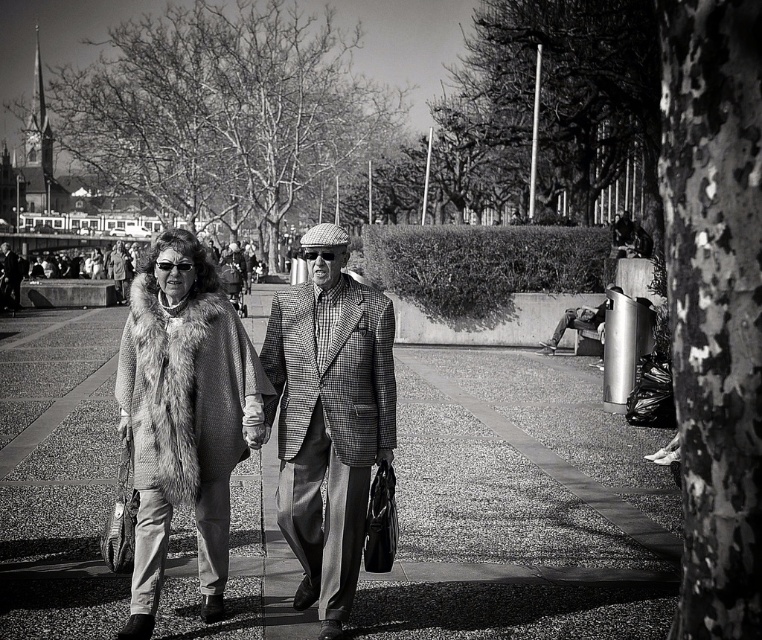
Is smooth concrete pavement at center to the left of fuzzy fur coat at center from the viewer's perspective?

In fact, smooth concrete pavement at center is to the right of fuzzy fur coat at center.

From the picture: Between smooth concrete pavement at center and fuzzy fur coat at center, which one has less height?

smooth concrete pavement at center

The height and width of the screenshot is (640, 762). Find the location of `smooth concrete pavement at center`. smooth concrete pavement at center is located at coordinates (520, 506).

Locate an element on the screen. The width and height of the screenshot is (762, 640). smooth concrete pavement at center is located at coordinates (520, 506).

Can you confirm if fuzzy fur coat at center is positioned to the left of houndstooth fabric jacket at center?

Indeed, fuzzy fur coat at center is positioned on the left side of houndstooth fabric jacket at center.

Who is more forward, (255,385) or (309,321)?

Point (255,385)

Does point (133, 477) lie in front of point (296, 358)?

Yes, it is in front of point (296, 358).

Locate an element on the screen. The height and width of the screenshot is (640, 762). fuzzy fur coat at center is located at coordinates (184, 417).

Is smooth concrete pavement at center wider than houndstooth fabric jacket at center?

Yes.

Is smooth concrete pavement at center shorter than houndstooth fabric jacket at center?

Indeed, smooth concrete pavement at center has a lesser height compared to houndstooth fabric jacket at center.

Does point (274, 561) come farther from viewer compared to point (365, 371)?

That is True.

The image size is (762, 640). In order to click on smooth concrete pavement at center in this screenshot , I will do `click(520, 506)`.